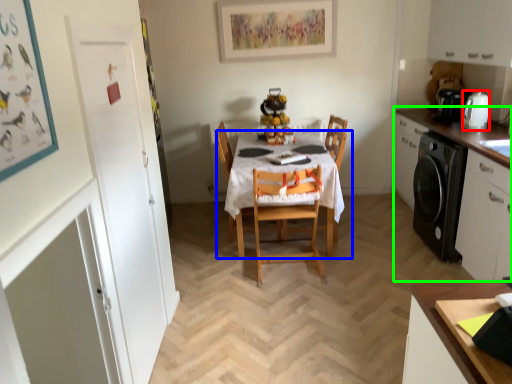
Question: Which object is positioned closest to appliance (highlighted by a red box)? Select from kitchen & dining room table (highlighted by a blue box) and cabinetry (highlighted by a green box).

Choices:
 (A) kitchen & dining room table
 (B) cabinetry

Answer: (B)